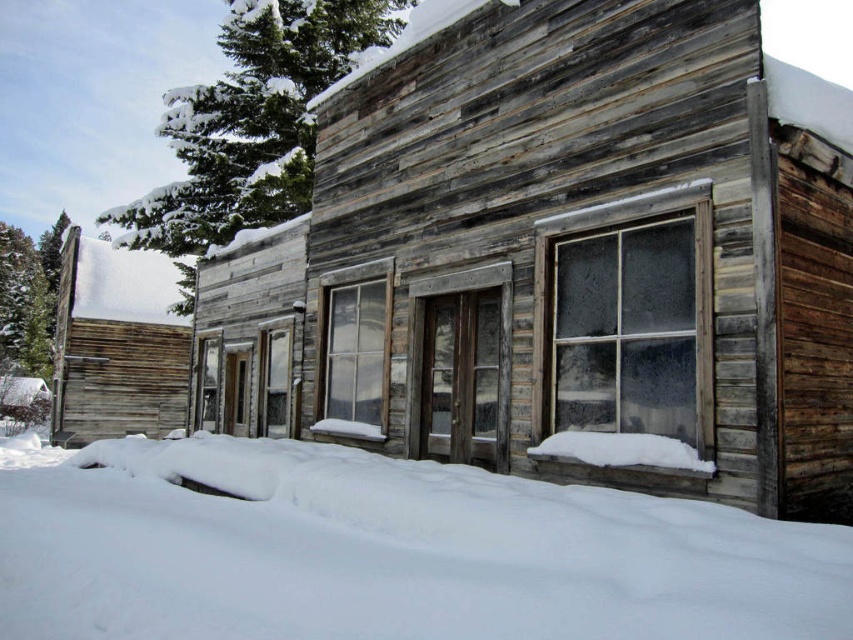
Is white fluffy snow at lower center below weathered wood cabin at left?

Actually, white fluffy snow at lower center is above weathered wood cabin at left.

Is white fluffy snow at lower center wider than weathered wood cabin at left?

In fact, white fluffy snow at lower center might be narrower than weathered wood cabin at left.

Describe the element at coordinates (390, 554) in the screenshot. The height and width of the screenshot is (640, 853). I see `white fluffy snow at lower center` at that location.

This screenshot has width=853, height=640. Identify the location of white fluffy snow at lower center. (390, 554).